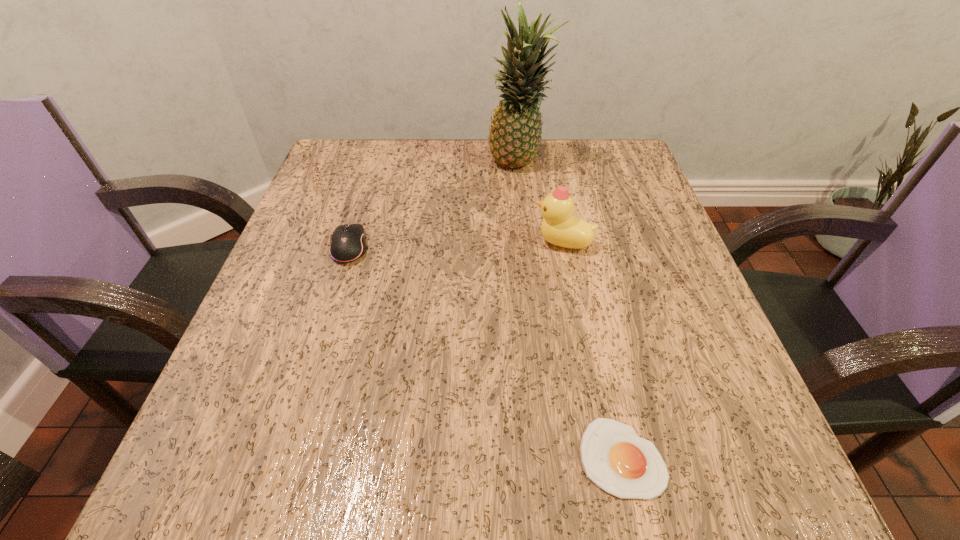
At what (x,y) coordinates should I click in order to perform the action: click on free spot that satisfies the following two spatial constraints: 1. on the back side of the egg yolk; 2. on the front-facing side of the duckling. Please return your answer as a coordinate pair (x, y). Looking at the image, I should click on (574, 242).

The image size is (960, 540). What are the coordinates of `free location that satisfies the following two spatial constraints: 1. on the front-facing side of the duckling; 2. on the left side of the nearest object` in the screenshot? It's located at (604, 457).

Find the location of a particular element. The image size is (960, 540). free spot that satisfies the following two spatial constraints: 1. on the back side of the pineapple; 2. on the left side of the third tallest object is located at coordinates (375, 165).

This screenshot has width=960, height=540. What are the coordinates of `vacant point that satisfies the following two spatial constraints: 1. on the back side of the tallest object; 2. on the left side of the computer mouse` in the screenshot? It's located at (375, 165).